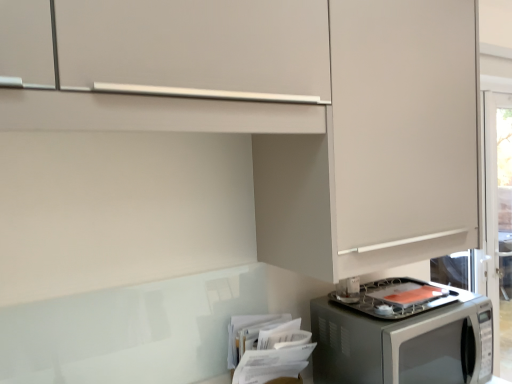
Question: Would you consider matte white cabinet at upper right to be distant from satin silver microwave at lower right?

Choices:
 (A) no
 (B) yes

Answer: (A)

Question: Can you confirm if matte white cabinet at upper right is smaller than satin silver microwave at lower right?

Choices:
 (A) no
 (B) yes

Answer: (A)

Question: Is matte white cabinet at upper right positioned in front of satin silver microwave at lower right?

Choices:
 (A) yes
 (B) no

Answer: (A)

Question: Is satin silver microwave at lower right located within matte white cabinet at upper right?

Choices:
 (A) yes
 (B) no

Answer: (B)

Question: Is matte white cabinet at upper right shorter than satin silver microwave at lower right?

Choices:
 (A) yes
 (B) no

Answer: (B)

Question: Is matte white cabinet at upper right outside satin silver microwave at lower right?

Choices:
 (A) yes
 (B) no

Answer: (A)

Question: From a real-world perspective, is satin silver microwave at lower right positioned over matte white cabinet at upper right based on gravity?

Choices:
 (A) no
 (B) yes

Answer: (A)

Question: Is satin silver microwave at lower right at the left side of matte white cabinet at upper right?

Choices:
 (A) yes
 (B) no

Answer: (B)

Question: Is satin silver microwave at lower right placed right next to matte white cabinet at upper right?

Choices:
 (A) no
 (B) yes

Answer: (A)

Question: Does satin silver microwave at lower right have a greater width compared to matte white cabinet at upper right?

Choices:
 (A) no
 (B) yes

Answer: (B)

Question: Would you say matte white cabinet at upper right is part of satin silver microwave at lower right's contents?

Choices:
 (A) no
 (B) yes

Answer: (A)

Question: From a real-world perspective, is satin silver microwave at lower right under matte white cabinet at upper right?

Choices:
 (A) no
 (B) yes

Answer: (B)

Question: From the image's perspective, is matte white cabinet at upper right positioned above or below satin silver microwave at lower right?

Choices:
 (A) below
 (B) above

Answer: (B)